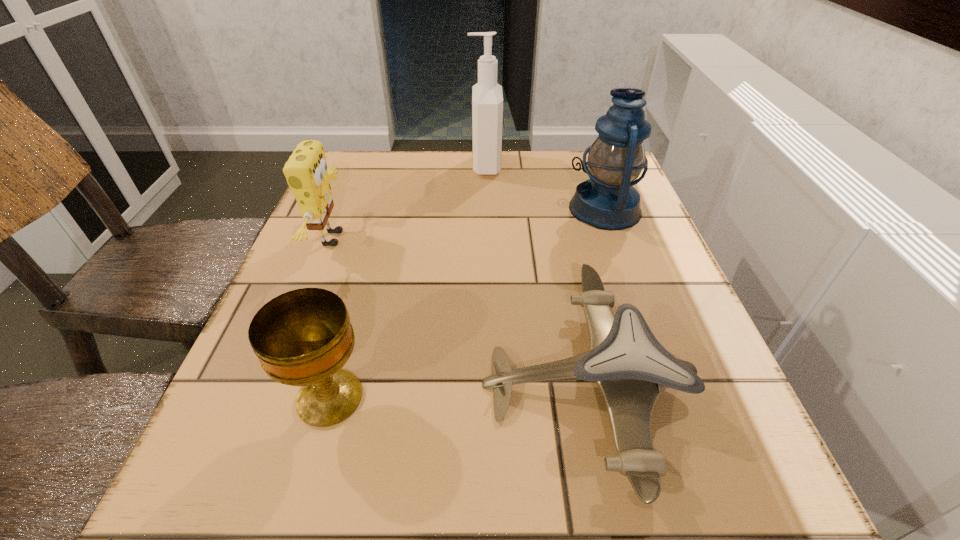
I want to click on sponge that is at the left edge, so click(x=306, y=171).

Find the location of `chalice at the left edge`. chalice at the left edge is located at coordinates (303, 337).

At what (x,y) coordinates should I click in order to perform the action: click on lantern that is at the right edge. Please return your answer as a coordinate pair (x, y). Looking at the image, I should click on (608, 201).

Where is `drone present at the right edge`? The height and width of the screenshot is (540, 960). drone present at the right edge is located at coordinates (631, 368).

Image resolution: width=960 pixels, height=540 pixels. I want to click on object that is at the far right corner, so click(608, 201).

Locate an element on the screen. object present at the near right corner is located at coordinates (631, 368).

Find the location of a particular element. This screenshot has width=960, height=540. vacant space at the far edge of the desktop is located at coordinates (411, 173).

In the image, there is a desktop. Where is `vacant space at the left edge`? The height and width of the screenshot is (540, 960). vacant space at the left edge is located at coordinates click(361, 260).

The image size is (960, 540). In the image, there is a desktop. In order to click on vacant space at the right edge in this screenshot , I will do `click(708, 375)`.

In the image, there is a desktop. Where is `vacant space at the far left corner`? vacant space at the far left corner is located at coordinates (354, 190).